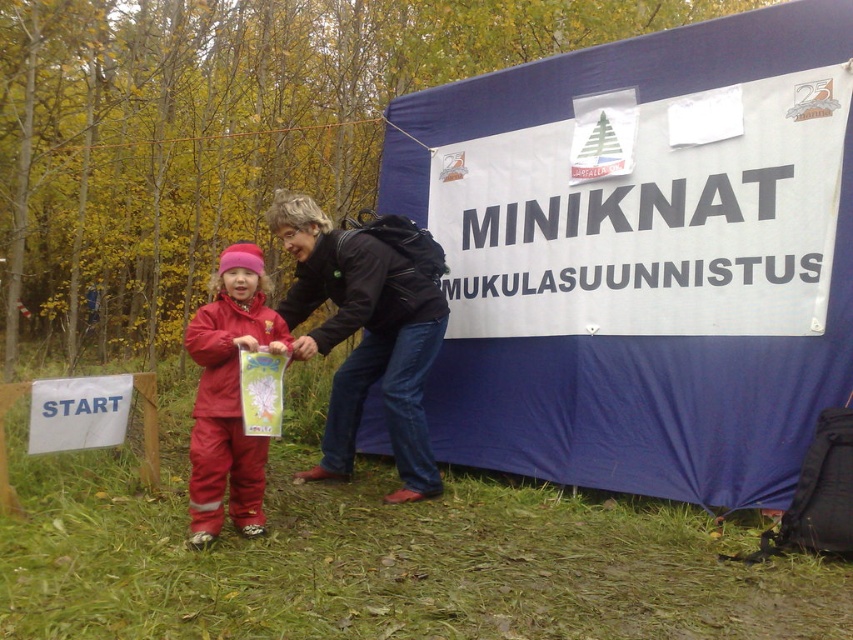
Question: Based on their relative distances, which object is farther from the black leather jacket at center?

Choices:
 (A) blue fabric tent at center
 (B) matte red snowsuit at center

Answer: (A)

Question: Is black leather jacket at center to the right of matte red snowsuit at center from the viewer's perspective?

Choices:
 (A) no
 (B) yes

Answer: (B)

Question: Based on their relative distances, which object is nearer to the black leather jacket at center?

Choices:
 (A) blue fabric tent at center
 (B) matte red snowsuit at center

Answer: (B)

Question: Estimate the real-world distances between objects in this image. Which object is farther from the matte red snowsuit at center?

Choices:
 (A) black leather jacket at center
 (B) blue fabric tent at center

Answer: (B)

Question: Can you confirm if blue fabric tent at center is smaller than black leather jacket at center?

Choices:
 (A) no
 (B) yes

Answer: (A)

Question: Can you confirm if blue fabric tent at center is positioned to the right of matte red snowsuit at center?

Choices:
 (A) no
 (B) yes

Answer: (B)